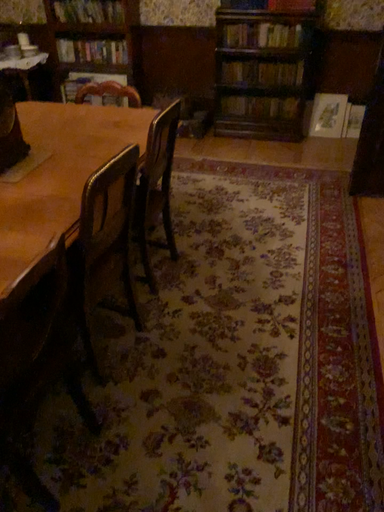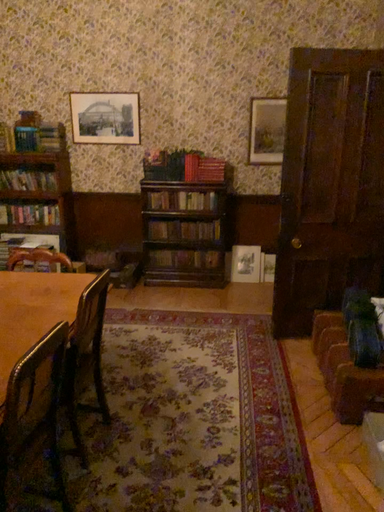
Question: How did the camera likely rotate when shooting the video?

Choices:
 (A) rotated left
 (B) rotated right

Answer: (B)